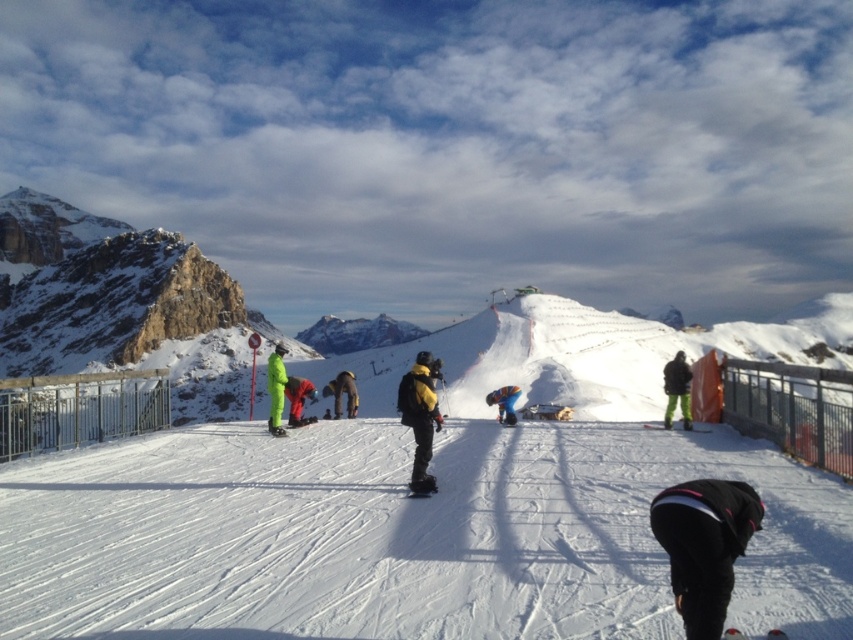
Can you confirm if black matte pants at lower right is taller than white matte ski at lower center?

Correct, black matte pants at lower right is much taller as white matte ski at lower center.

Which of these two, black matte pants at lower right or white matte ski at lower center, stands shorter?

With less height is white matte ski at lower center.

Is point (730, 532) positioned in front of point (786, 637)?

No, it is behind (786, 637).

Where is `black matte pants at lower right`? This screenshot has width=853, height=640. black matte pants at lower right is located at coordinates (704, 545).

Is point (289, 387) farther from camera compared to point (773, 636)?

Yes, point (289, 387) is farther from viewer.

Can you confirm if red fabric jacket at center is positioned below white matte ski at lower center?

Actually, red fabric jacket at center is above white matte ski at lower center.

In order to click on red fabric jacket at center in this screenshot , I will do `click(299, 400)`.

Can you confirm if black matte pants at lower right is taller than yellow matte snowboarder at center?

No, black matte pants at lower right is not taller than yellow matte snowboarder at center.

The height and width of the screenshot is (640, 853). I want to click on black matte pants at lower right, so click(x=704, y=545).

Image resolution: width=853 pixels, height=640 pixels. I want to click on black matte pants at lower right, so click(x=704, y=545).